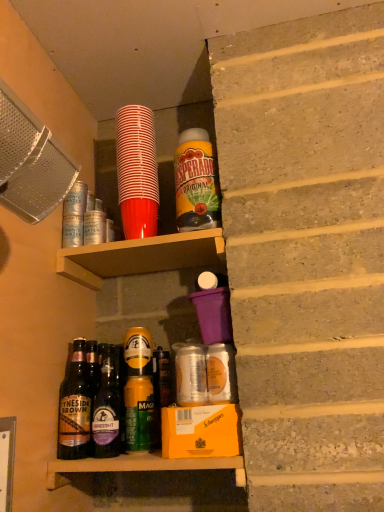
Question: Is brown glass bottle at lower left, the fifth bottle from the right, taller than red plastic cup at upper center, positioned as the 3th bottle in left-to-right order?

Choices:
 (A) yes
 (B) no

Answer: (B)

Question: Does brown glass bottle at lower left, the first bottle when ordered from left to right, appear on the left side of red plastic cup at upper center, which is the 3th bottle in right-to-left order?

Choices:
 (A) no
 (B) yes

Answer: (B)

Question: Is brown glass bottle at lower left, the first bottle when ordered from left to right, smaller than red plastic cup at upper center, positioned as the 3th bottle in left-to-right order?

Choices:
 (A) no
 (B) yes

Answer: (B)

Question: Is brown glass bottle at lower left, the fifth bottle from the right, shorter than red plastic cup at upper center, which is the 3th bottle in right-to-left order?

Choices:
 (A) yes
 (B) no

Answer: (A)

Question: From the image's perspective, would you say brown glass bottle at lower left, the first bottle when ordered from left to right, is shown under red plastic cup at upper center, positioned as the 3th bottle in left-to-right order?

Choices:
 (A) no
 (B) yes

Answer: (B)

Question: From the image's perspective, is brown glass bottle at lower left, the fifth bottle from the right, located above red plastic cup at upper center, which is the 3th bottle in right-to-left order?

Choices:
 (A) yes
 (B) no

Answer: (B)

Question: Would you say dark brown glass bottle at center, positioned as the 2th bottle in left-to-right order, is part of brown glass bottle at lower left, the first bottle when ordered from left to right,'s contents?

Choices:
 (A) yes
 (B) no

Answer: (B)

Question: Is brown glass bottle at lower left, the fifth bottle from the right, positioned with its back to dark brown glass bottle at center, positioned as the 2th bottle in left-to-right order?

Choices:
 (A) yes
 (B) no

Answer: (B)

Question: From a real-world perspective, does brown glass bottle at lower left, the fifth bottle from the right, stand above dark brown glass bottle at center, the fourth bottle from the right?

Choices:
 (A) no
 (B) yes

Answer: (B)

Question: Is brown glass bottle at lower left, the fifth bottle from the right, beside dark brown glass bottle at center, the fourth bottle from the right?

Choices:
 (A) no
 (B) yes

Answer: (B)

Question: Considering the relative sizes of brown glass bottle at lower left, the fifth bottle from the right, and dark brown glass bottle at center, the fourth bottle from the right, in the image provided, is brown glass bottle at lower left, the fifth bottle from the right, wider than dark brown glass bottle at center, the fourth bottle from the right,?

Choices:
 (A) yes
 (B) no

Answer: (A)

Question: From a real-world perspective, is brown glass bottle at lower left, the first bottle when ordered from left to right, positioned under dark brown glass bottle at center, positioned as the 2th bottle in left-to-right order, based on gravity?

Choices:
 (A) yes
 (B) no

Answer: (B)

Question: Does dark brown glass bottle at center, positioned as the 2th bottle in left-to-right order, have a lesser width compared to purple plastic cup at upper center?

Choices:
 (A) yes
 (B) no

Answer: (A)